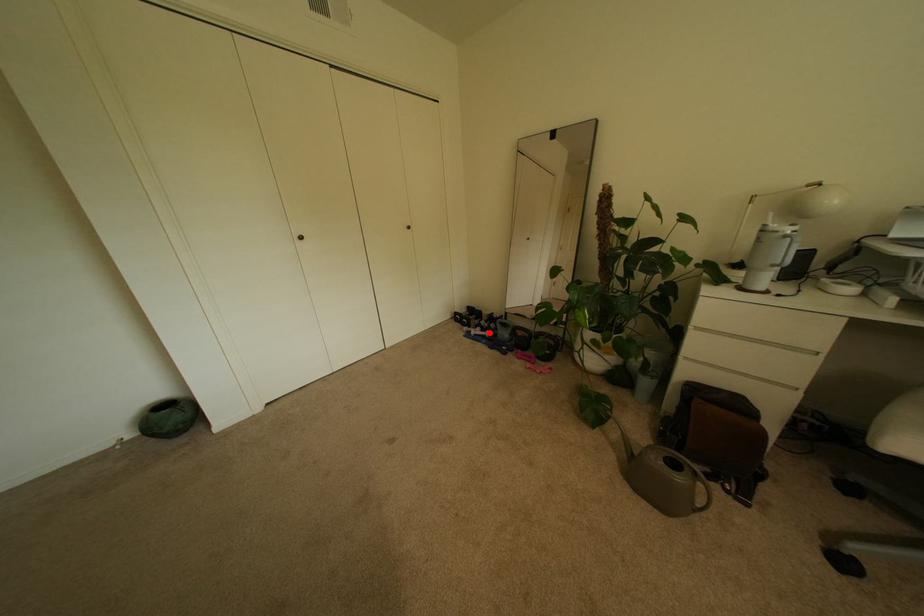
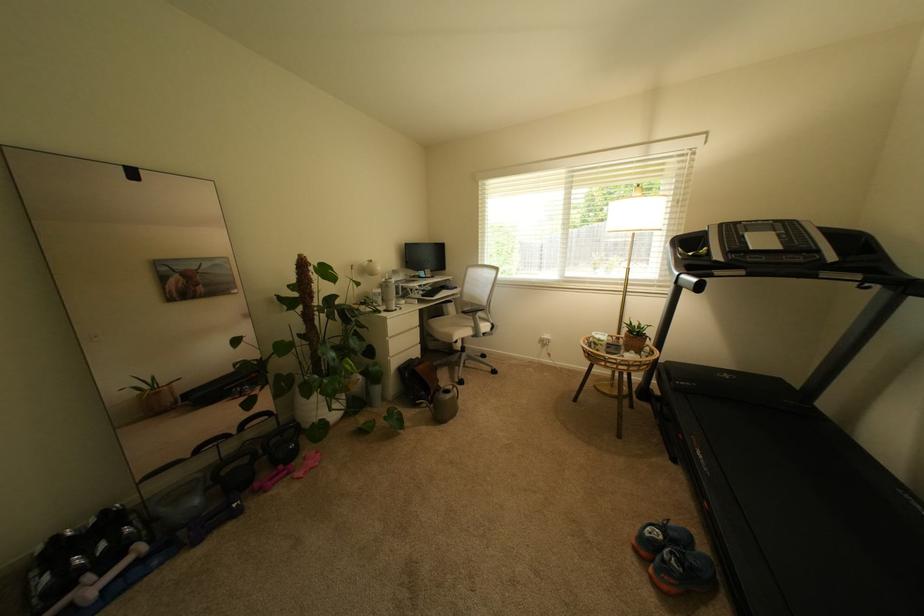
Question: I am providing you with two images of the same scene from different viewpoints. A red point is shown in image1. For the corresponding object point in image2, is it positioned nearer or farther from the camera?

Choices:
 (A) Nearer
 (B) Farther

Answer: (A)